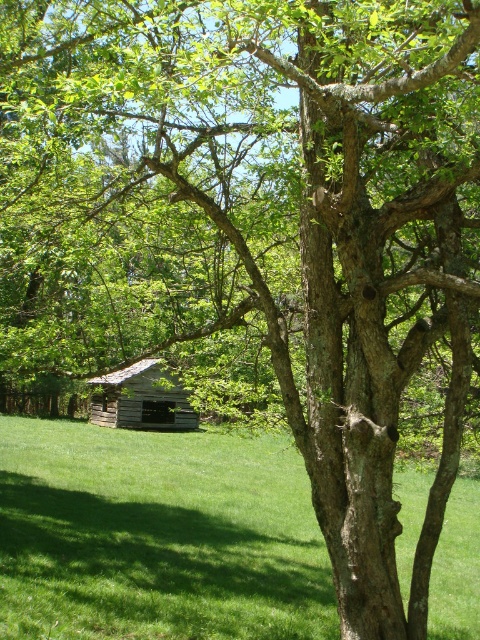
Does green grass at center have a lesser height compared to weathered wood cabin at center?

Answer: Indeed, green grass at center has a lesser height compared to weathered wood cabin at center.

Is green grass at center closer to the viewer compared to weathered wood cabin at center?

Yes, green grass at center is closer to the viewer.

The height and width of the screenshot is (640, 480). Identify the location of green grass at center. tap(156, 536).